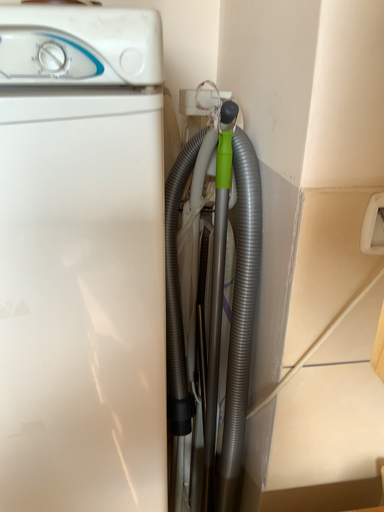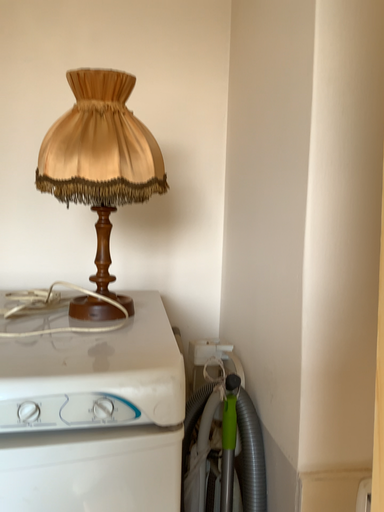
Question: Which way did the camera rotate in the video?

Choices:
 (A) rotated upward
 (B) rotated downward

Answer: (A)